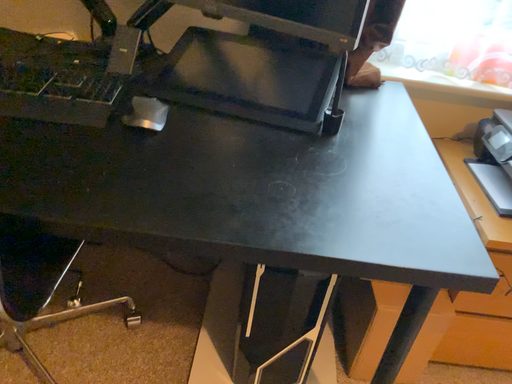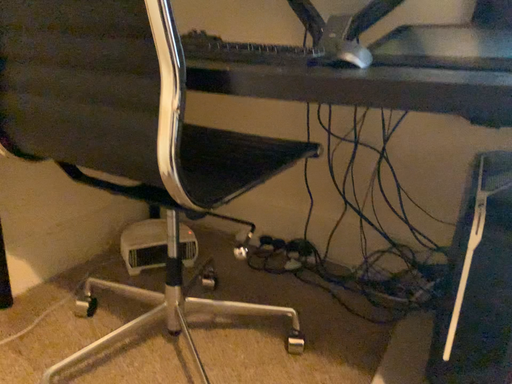
Question: How did the camera likely rotate when shooting the video?

Choices:
 (A) rotated upward
 (B) rotated downward

Answer: (A)